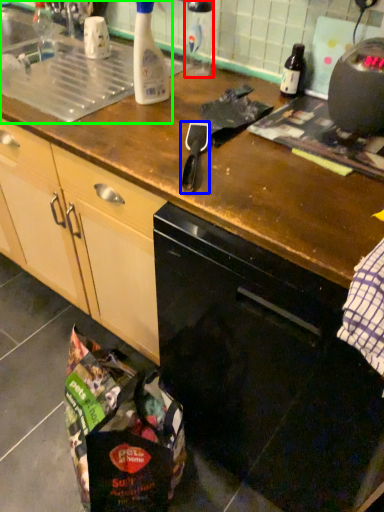
Question: Which is farther away from bottle (highlighted by a red box)? appliance (highlighted by a blue box) or sink (highlighted by a green box)?

Choices:
 (A) appliance
 (B) sink

Answer: (A)